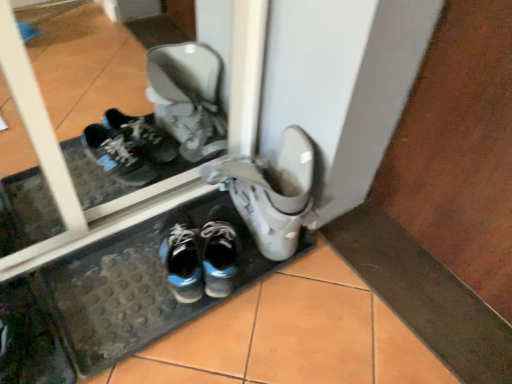
Question: Do you think blue synthetic sneakers at center, positioned as the 2th footwear in right-to-left order, is within shiny blue running shoe at center, or outside of it?

Choices:
 (A) inside
 (B) outside

Answer: (B)

Question: Considering the positions of blue synthetic sneakers at center, which is counted as the first footwear, starting from the left, and shiny blue running shoe at center in the image, is blue synthetic sneakers at center, which is counted as the first footwear, starting from the left, wider or thinner than shiny blue running shoe at center?

Choices:
 (A) thin
 (B) wide

Answer: (B)

Question: Estimate the real-world distances between objects in this image. Which object is closer to the white matte boot at center, which is counted as the first footwear, starting from the right?

Choices:
 (A) shiny blue running shoe at center
 (B) blue synthetic sneakers at center, positioned as the 2th footwear in right-to-left order

Answer: (B)

Question: Based on their relative distances, which object is farther from the blue synthetic sneakers at center, which is counted as the first footwear, starting from the left?

Choices:
 (A) shiny blue running shoe at center
 (B) white matte boot at center, the 2th footwear viewed from the left

Answer: (B)